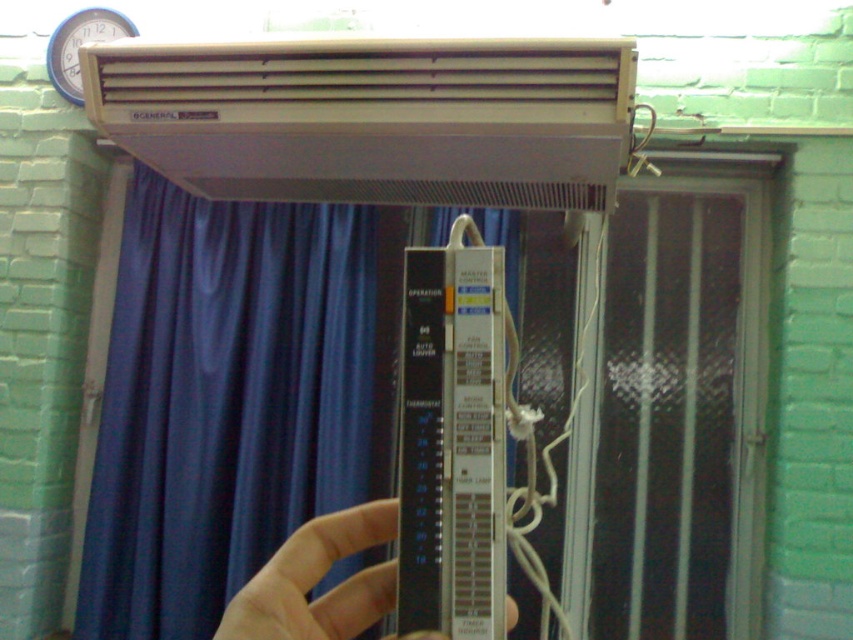
Question: Is blue satin curtain at center smaller than slightly translucent plastic at center?

Choices:
 (A) no
 (B) yes

Answer: (A)

Question: Observing the image, what is the correct spatial positioning of blue satin curtain at center in reference to beige plastic air conditioner at upper center?

Choices:
 (A) above
 (B) below

Answer: (B)

Question: Which of the following is the closest to the observer?

Choices:
 (A) slightly translucent plastic at center
 (B) beige plastic air conditioner at upper center
 (C) blue satin curtain at center

Answer: (A)

Question: Considering the relative positions of blue satin curtain at center and slightly translucent plastic at center in the image provided, where is blue satin curtain at center located with respect to slightly translucent plastic at center?

Choices:
 (A) below
 (B) above

Answer: (A)

Question: Which object is positioned closest to the slightly translucent plastic at center?

Choices:
 (A) blue satin curtain at center
 (B) beige plastic air conditioner at upper center

Answer: (B)

Question: Which object is positioned farthest from the slightly translucent plastic at center?

Choices:
 (A) beige plastic air conditioner at upper center
 (B) blue satin curtain at center

Answer: (B)